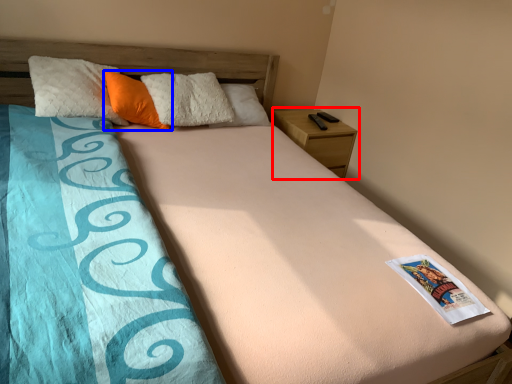
Question: Which object appears farthest to the camera in this image, nightstand (highlighted by a red box) or pillow (highlighted by a blue box)?

Choices:
 (A) nightstand
 (B) pillow

Answer: (A)